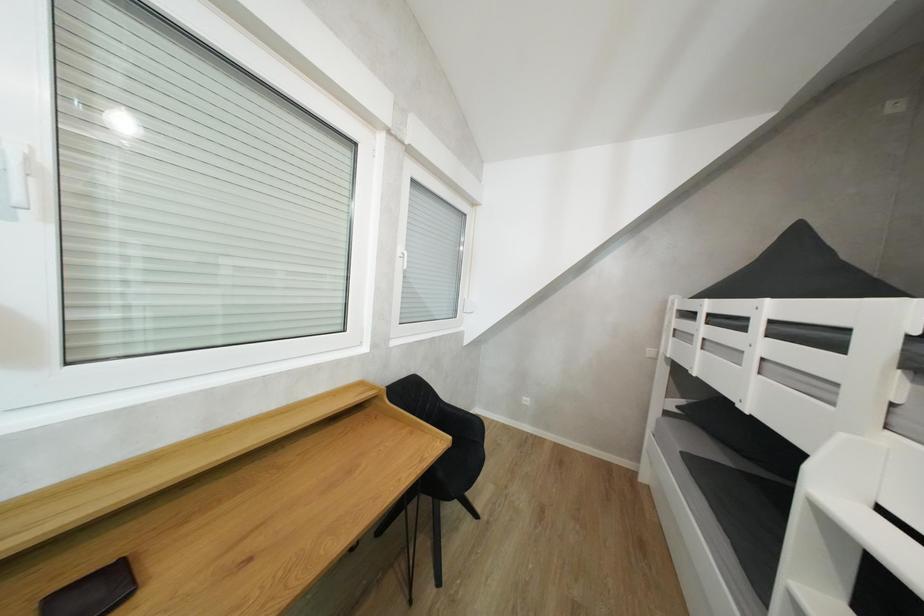
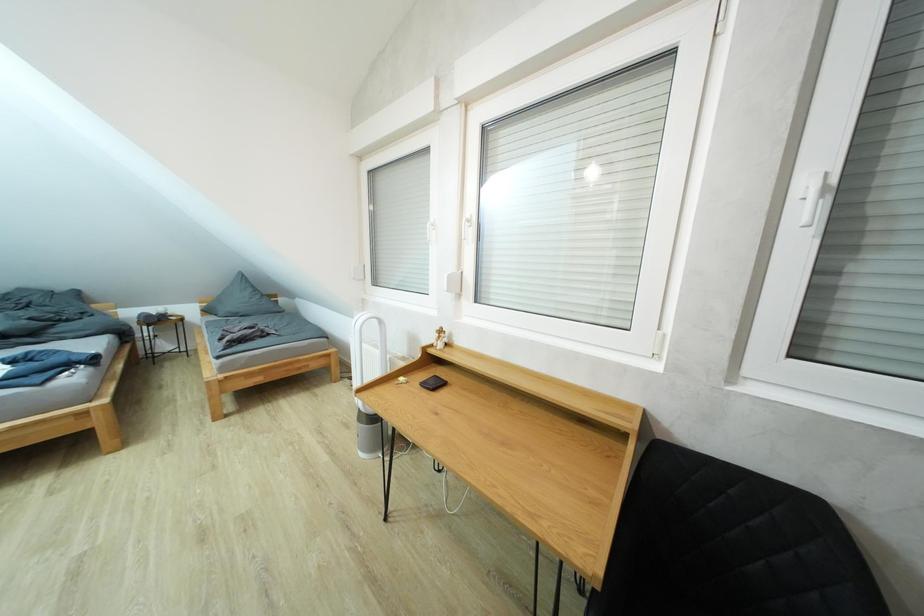
Question: The images are taken continuously from a first-person perspective. In which direction is your viewpoint rotating?

Choices:
 (A) Left
 (B) Right
 (C) Up
 (D) Down

Answer: (A)